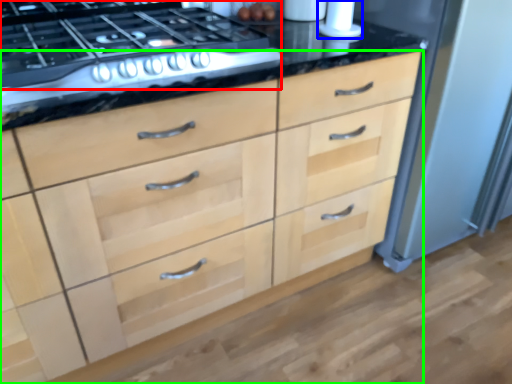
Question: Based on their relative distances, which object is nearer to gas stove (highlighted by a red box)? Choose from appliance (highlighted by a blue box) and chest of drawers (highlighted by a green box).

Choices:
 (A) appliance
 (B) chest of drawers

Answer: (B)